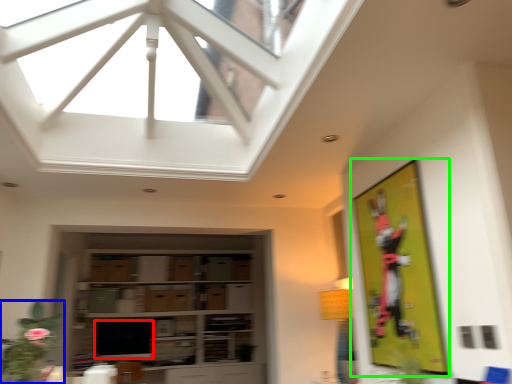
Question: Based on their relative distances, which object is farther from window screen (highlighted by a red box)? Choose from plant (highlighted by a blue box) and bulletin board (highlighted by a green box).

Choices:
 (A) plant
 (B) bulletin board

Answer: (B)